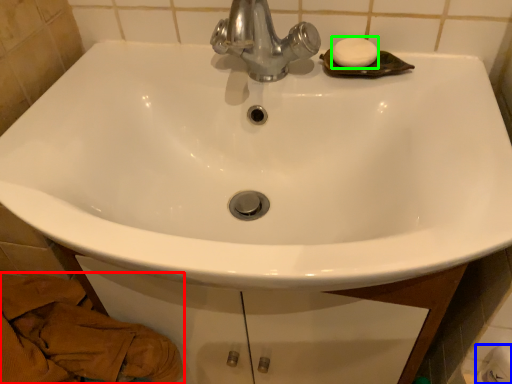
Question: Based on their relative distances, which object is farther from material (highlighted by a red box)? Choose from toilet paper (highlighted by a blue box) and soap (highlighted by a green box).

Choices:
 (A) toilet paper
 (B) soap

Answer: (A)